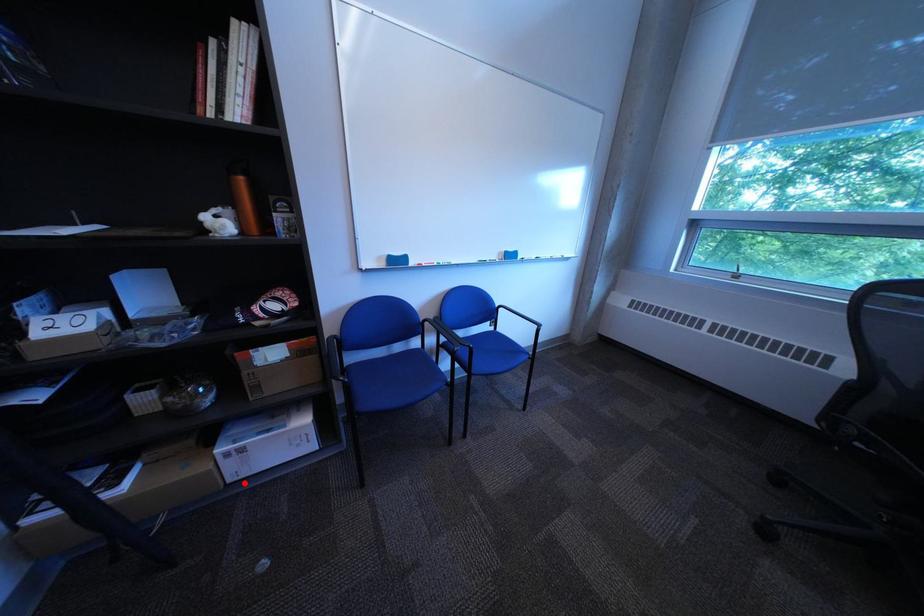
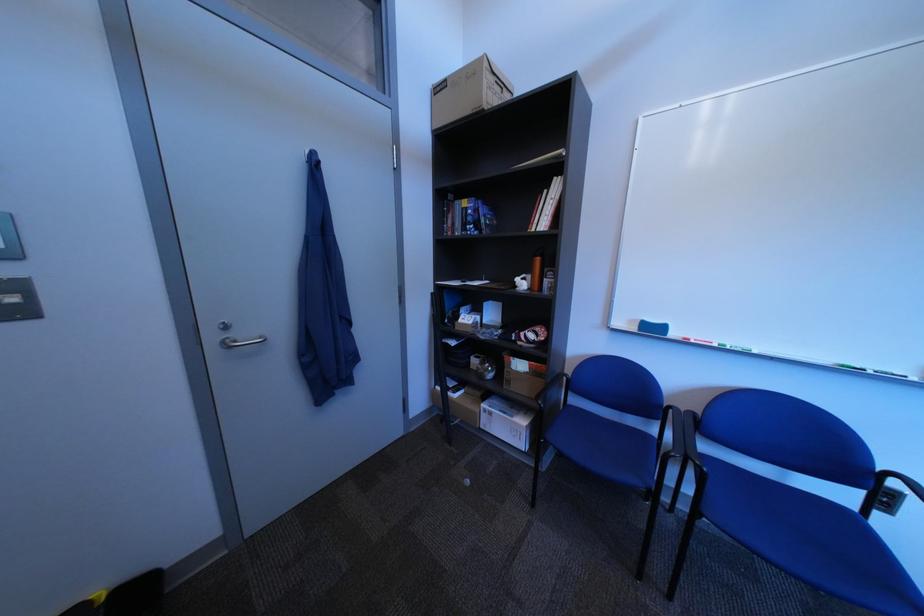
Question: I am providing you with two images of the same scene from different viewpoints. A red point is shown in image1. For the corresponding object point in image2, is it positioned nearer or farther from the camera?

Choices:
 (A) Nearer
 (B) Farther

Answer: (B)